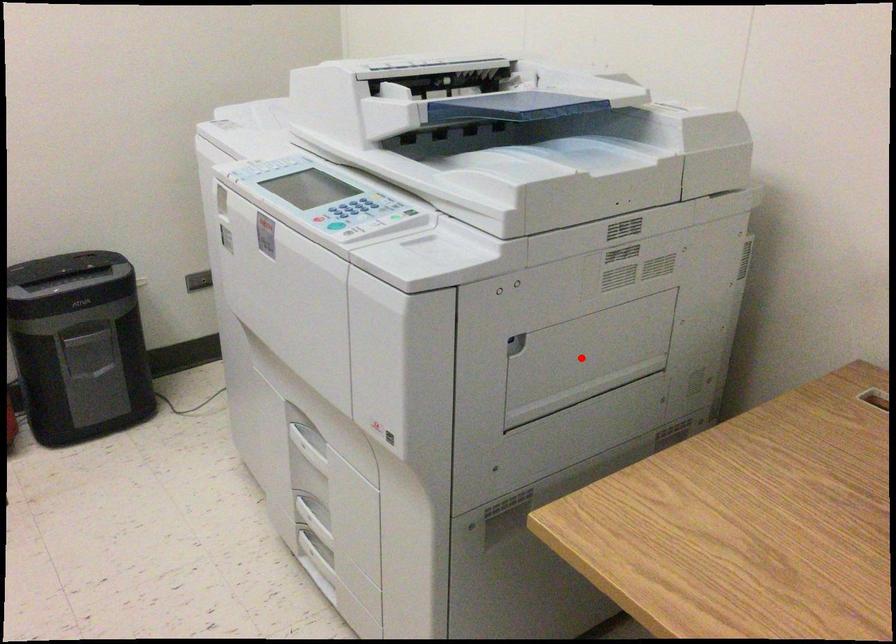
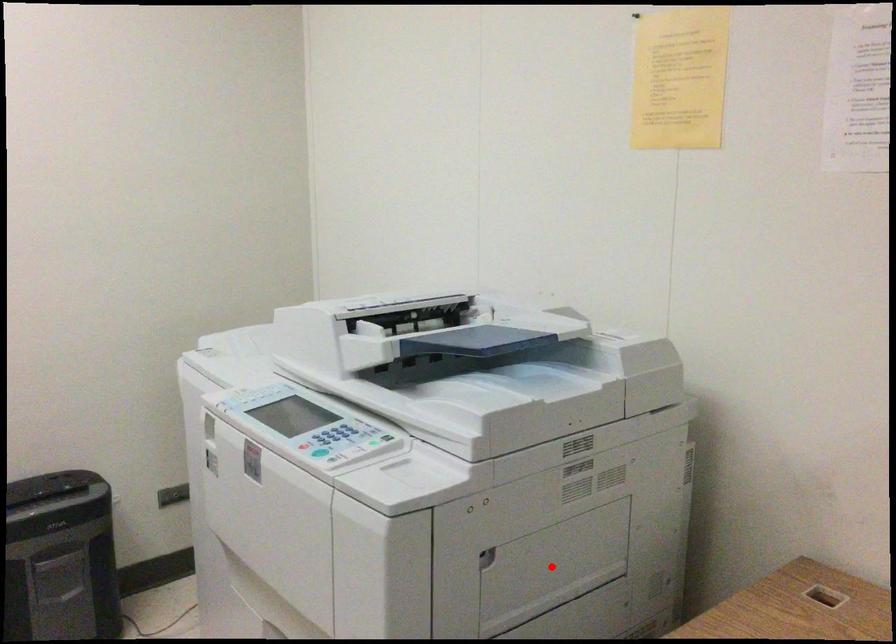
I am providing you with two images of the same scene from different viewpoints. A red point is marked on the first image and another point is marked on the second image. Do the highlighted points in image1 and image2 indicate the same real-world spot?

Yes